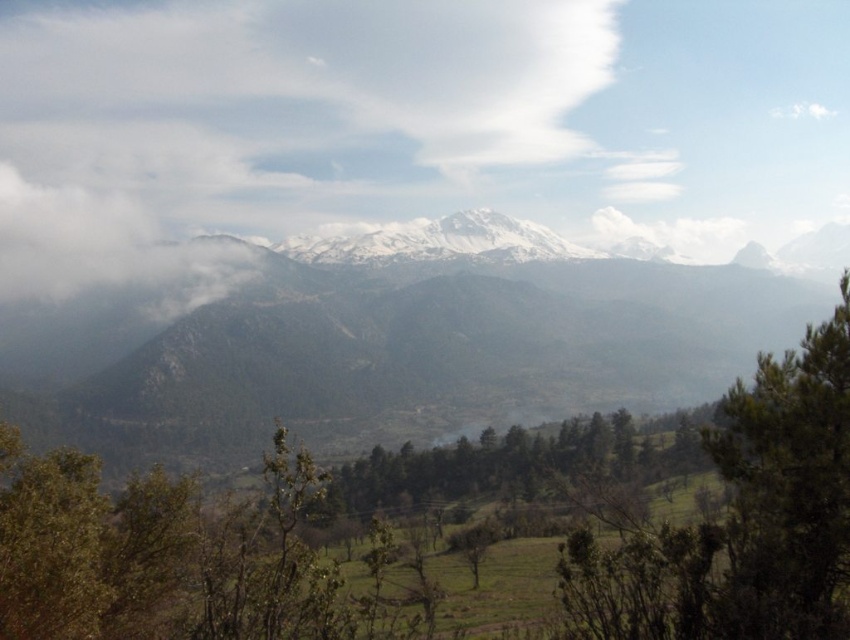
Is point (553, 396) positioned behind point (789, 417)?

Yes, it is behind point (789, 417).

Does snowy rock mountain range at center appear under green leafy tree at lower right?

Actually, snowy rock mountain range at center is above green leafy tree at lower right.

The height and width of the screenshot is (640, 850). In order to click on snowy rock mountain range at center in this screenshot , I will do `click(397, 346)`.

Find the location of a particular element. This screenshot has width=850, height=640. snowy rock mountain range at center is located at coordinates (397, 346).

Is white fluffy cloud at upper center taller than green leafy tree at lower right?

Yes, white fluffy cloud at upper center is taller than green leafy tree at lower right.

Does white fluffy cloud at upper center have a lesser height compared to green leafy tree at lower right?

Incorrect, white fluffy cloud at upper center's height does not fall short of green leafy tree at lower right's.

The image size is (850, 640). In order to click on white fluffy cloud at upper center in this screenshot , I will do `click(268, 120)`.

Locate an element on the screen. This screenshot has height=640, width=850. white fluffy cloud at upper center is located at coordinates (268, 120).

The image size is (850, 640). What do you see at coordinates (268, 120) in the screenshot? I see `white fluffy cloud at upper center` at bounding box center [268, 120].

Is white fluffy cloud at upper center to the left of snowy rock mountain range at center from the viewer's perspective?

Indeed, white fluffy cloud at upper center is positioned on the left side of snowy rock mountain range at center.

Identify the location of white fluffy cloud at upper center. The height and width of the screenshot is (640, 850). (268, 120).